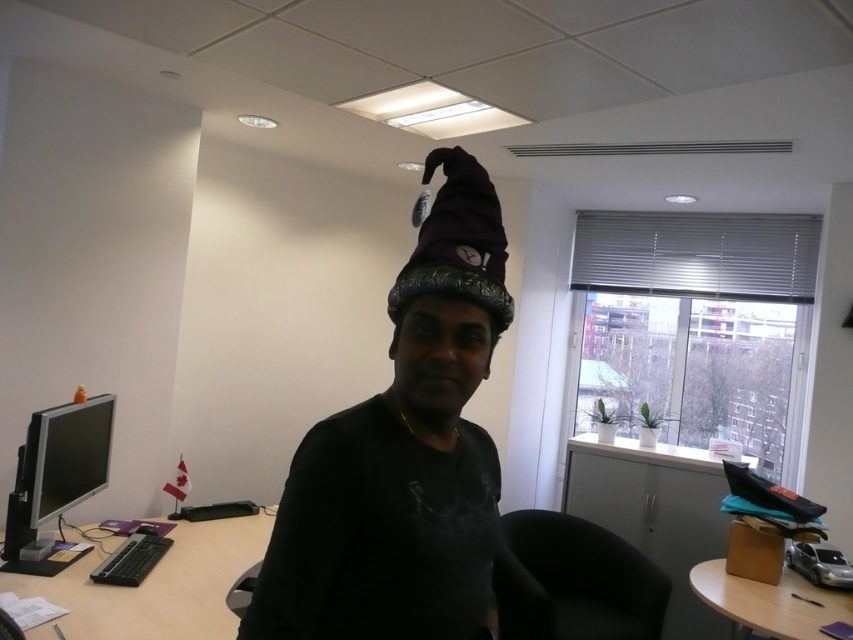
Is point (202, 531) more distant than point (780, 632)?

Yes, it is.

Between point (247, 518) and point (842, 609), which one is positioned in front?

Point (842, 609)

Image resolution: width=853 pixels, height=640 pixels. I want to click on black plastic computer desk at lower left, so click(157, 584).

Between black plastic computer desk at lower left and matte black monitor at left, which one has more height?

Standing taller between the two is matte black monitor at left.

Can you confirm if black plastic computer desk at lower left is smaller than matte black monitor at left?

Incorrect, black plastic computer desk at lower left is not smaller in size than matte black monitor at left.

Is point (39, 580) positioned after point (51, 477)?

That is False.

At what (x,y) coordinates should I click in order to perform the action: click on black plastic computer desk at lower left. Please return your answer as a coordinate pair (x, y). Looking at the image, I should click on (157, 584).

Does matte purple wizard hat at center come in front of matte black monitor at left?

Yes, it is.

Consider the image. Measure the distance between matte purple wizard hat at center and camera.

87.79 centimeters

This screenshot has height=640, width=853. I want to click on matte purple wizard hat at center, so click(x=403, y=454).